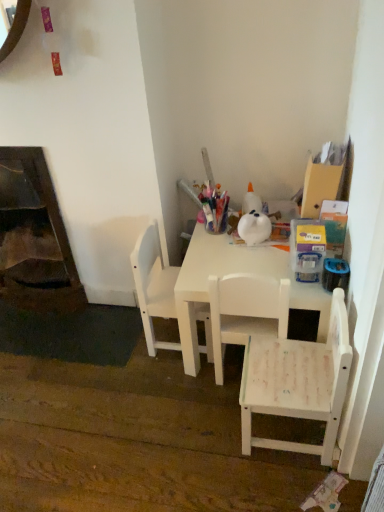
What are the coordinates of `free spot to the left of white matte chair at center, positioned as the 1th chair in left-to-right order` in the screenshot? It's located at [117, 342].